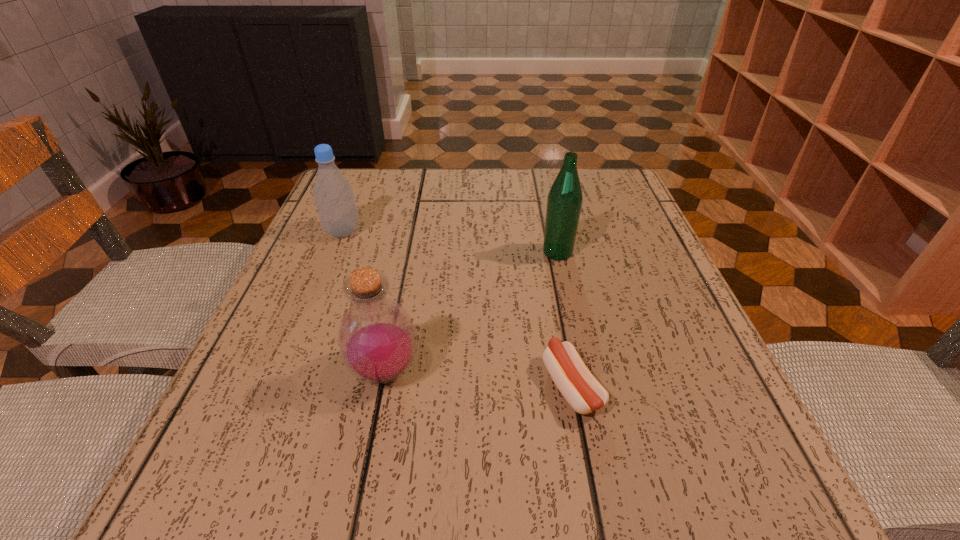
Image resolution: width=960 pixels, height=540 pixels. I want to click on blank region between the third nearest object and the shortest object, so click(564, 319).

Identify the location of vacant area that lies between the rightmost bottle and the shortest object. The height and width of the screenshot is (540, 960). (564, 319).

The height and width of the screenshot is (540, 960). I want to click on vacant area that lies between the shortest object and the farthest object, so click(457, 309).

Find the location of a particular element. free space between the third nearest object and the sausage is located at coordinates (564, 319).

At what (x,y) coordinates should I click in order to perform the action: click on vacant space in between the shortest object and the nearest bottle. Please return your answer as a coordinate pair (x, y). The image size is (960, 540). Looking at the image, I should click on (478, 379).

This screenshot has height=540, width=960. In order to click on empty location between the third object from right to left and the second nearest bottle in this screenshot , I will do `click(471, 312)`.

The width and height of the screenshot is (960, 540). I want to click on vacant area that lies between the second bottle from right to left and the second farthest bottle, so click(x=471, y=312).

Locate an element on the screen. empty location between the leftmost bottle and the shortest object is located at coordinates (457, 309).

You are a GUI agent. You are given a task and a screenshot of the screen. Output one action in this format:
    pyautogui.click(x=<x>, y=<y>)
    Task: Click on the closest object to the rightmost bottle
    The image size is (960, 540).
    Given the screenshot: What is the action you would take?
    pyautogui.click(x=576, y=383)

At what (x,y) coordinates should I click in order to perform the action: click on object that ranks as the closest to the rightmost bottle. Please return your answer as a coordinate pair (x, y). The height and width of the screenshot is (540, 960). Looking at the image, I should click on (576, 383).